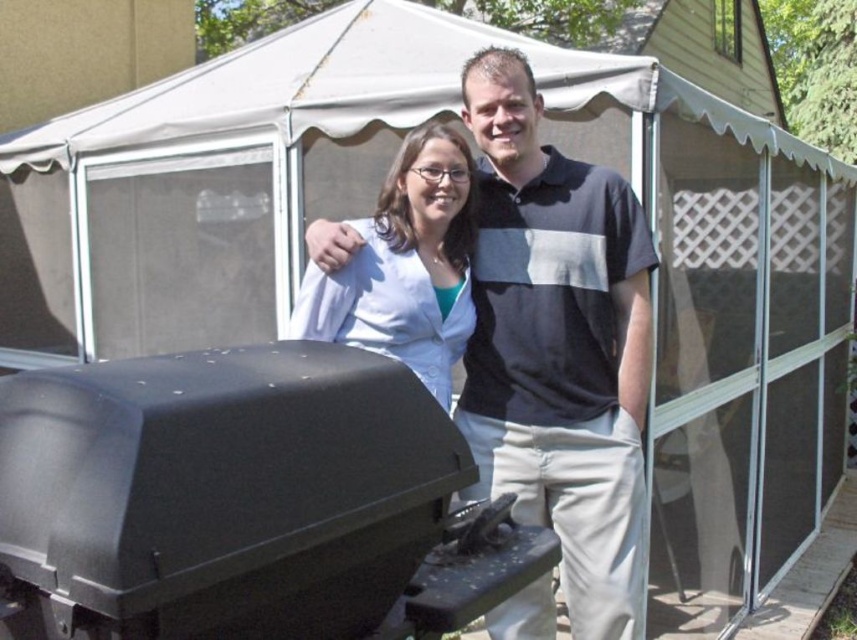
You are standing in front of the tent and want to touch both the white fabric canopy at upper center and the white matte shirt at center. Which object should you reach for first to touch the one closer to you?

You should reach for the white matte shirt at center first because it is closer to you than the white fabric canopy at upper center, which is further away.

You are a photographer trying to capture a clear shot of the white matte shirt at center without the white fabric canopy at upper center overlapping it. Can you adjust your position to avoid the canopy?

The white fabric canopy at upper center might be wider than the white matte shirt at center, so adjusting your position might be necessary to avoid overlap. Move slightly to the side or lower your angle to frame the shirt without the canopy.

You are a photographer taking a picture of the scene. You want to ensure the black matte barbecue grill at lower left is visible in the frame. Since the white matte shirt at center is blocking part of the grill, how should you adjust your camera angle?

The black matte barbecue grill at lower left is below the white matte shirt at center. To ensure visibility, lower the camera angle so the grill is not obstructed by the shirt.